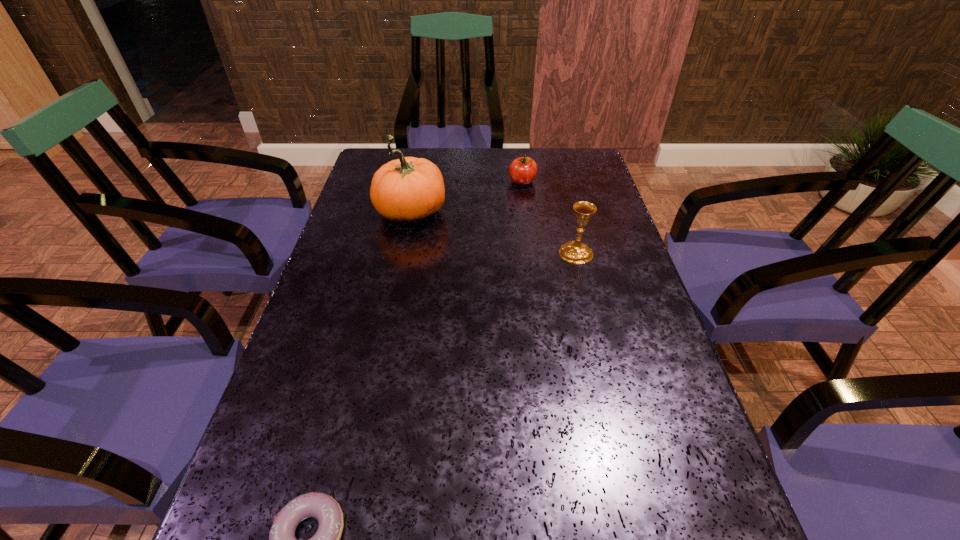
Find the location of a particular element. the second farthest object is located at coordinates (407, 189).

You are a GUI agent. You are given a task and a screenshot of the screen. Output one action in this format:
    pyautogui.click(x=<x>, y=<y>)
    Task: Click on the tallest object
    This screenshot has width=960, height=540.
    Given the screenshot: What is the action you would take?
    pyautogui.click(x=407, y=189)

Locate an element on the screen. the second nearest object is located at coordinates (575, 252).

This screenshot has width=960, height=540. Find the location of `the rightmost object`. the rightmost object is located at coordinates (575, 252).

What are the coordinates of `the farthest object` in the screenshot? It's located at (522, 171).

Where is `the second shortest object`? The image size is (960, 540). the second shortest object is located at coordinates (522, 171).

Find the location of `vacant space positioned 0.220m on the front of the tallest object`. vacant space positioned 0.220m on the front of the tallest object is located at coordinates (395, 296).

This screenshot has height=540, width=960. What are the coordinates of `blank space located 0.280m on the front of the rightmost object` in the screenshot? It's located at (600, 352).

Locate an element on the screen. The image size is (960, 540). vacant space located on the left of the apple is located at coordinates (458, 182).

Identify the location of object that is at the far edge. (522, 171).